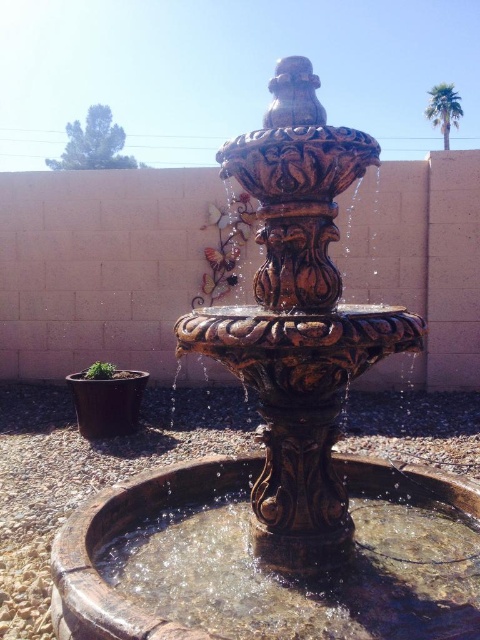
You are a gardener who wants to place a new potted plant between the clear glass water at center and the green leafy palm at upper right. Based on their widths, which object should you position closer to the potted plant to ensure it has enough space?

The clear glass water at center is wider than the green leafy palm at upper right, so you should place the potted plant closer to the green leafy palm at upper right to ensure enough space.

You are a gardener planning to trim the green leafy palm at upper right and the clear glass water at center. Which object requires a ladder to reach its top?

The green leafy palm at upper right requires a ladder to reach its top because it is taller than the clear glass water at center.

You are standing in front of the fountain and want to take a photo of the clear glass water at center and the green leafy palm at upper right. Which object will appear larger in the photo?

The clear glass water at center will appear larger in the photo because it is closer to the viewer than the green leafy palm at upper right.